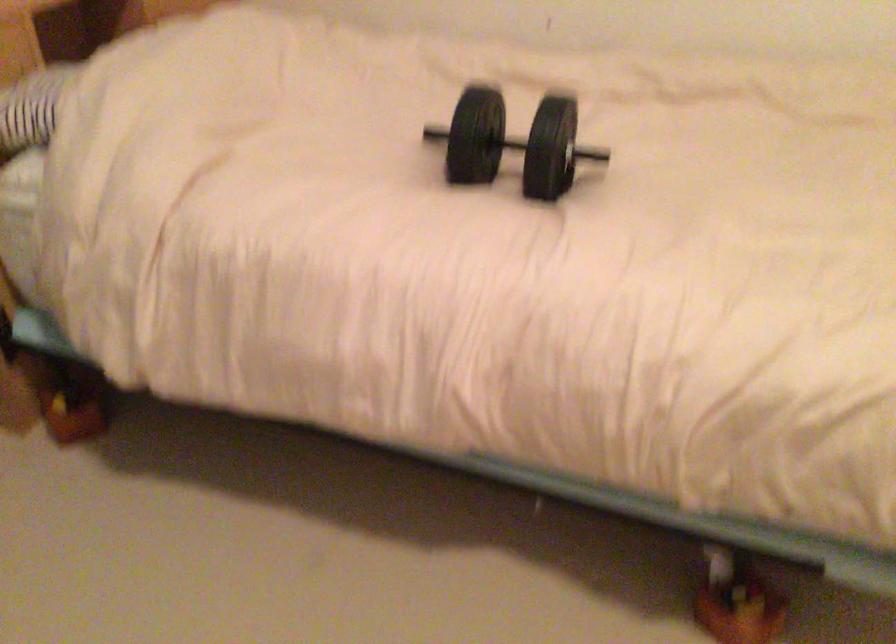
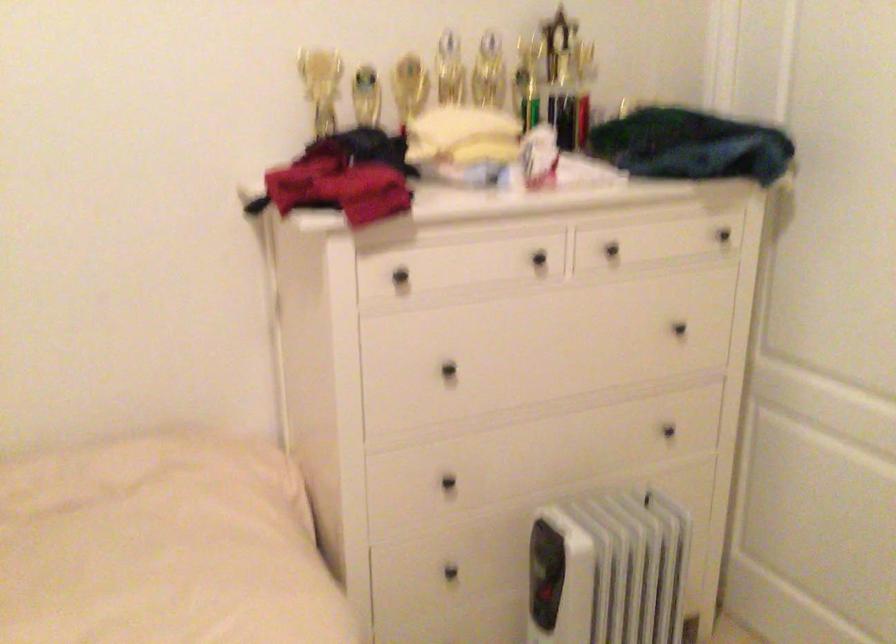
Question: The camera is either moving clockwise (left) or counter-clockwise (right) around the object. The first image is from the beginning of the video and the second image is from the end. Is the camera moving left or right when shooting the video?

Choices:
 (A) Left
 (B) Right

Answer: (A)